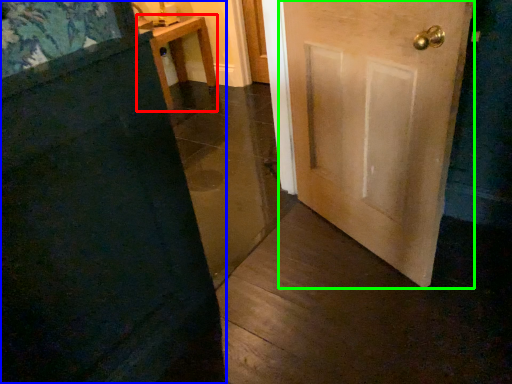
Question: Which is nearer to the furniture (highlighted by a red box)? door (highlighted by a blue box) or door (highlighted by a green box).

Choices:
 (A) door
 (B) door

Answer: (B)